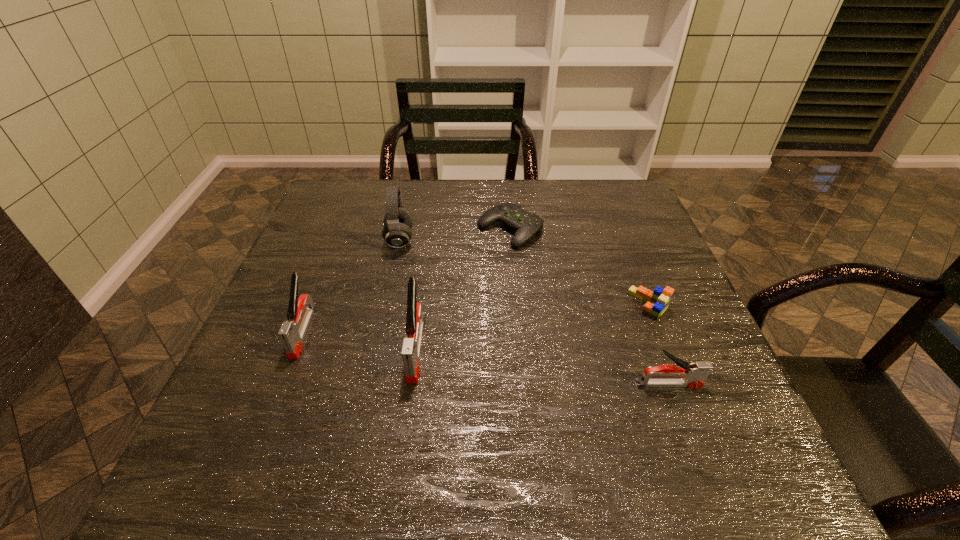
Where is `vacant space in between the second shortest stapler and the third object from right to left`? Image resolution: width=960 pixels, height=540 pixels. vacant space in between the second shortest stapler and the third object from right to left is located at coordinates click(x=407, y=280).

Where is `empty space that is in between the third tallest object and the shortest object`? empty space that is in between the third tallest object and the shortest object is located at coordinates (407, 280).

Locate an element on the screen. The width and height of the screenshot is (960, 540). free space between the shortest object and the second stapler from left to right is located at coordinates (463, 289).

What are the coordinates of `vacant space in between the Lego and the second object from left to right` in the screenshot? It's located at (524, 272).

The image size is (960, 540). What are the coordinates of `object that is the second nearest to the fifth object from right to left` in the screenshot? It's located at (292, 332).

At what (x,y) coordinates should I click in order to perform the action: click on the fifth closest object to the leftmost stapler. Please return your answer as a coordinate pair (x, y). The width and height of the screenshot is (960, 540). Looking at the image, I should click on (657, 301).

Identify which stapler is located as the nearest to the leftmost stapler. Please provide its 2D coordinates. Your answer should be formatted as a tuple, i.e. [(x, y)], where the tuple contains the x and y coordinates of a point satisfying the conditions above.

[(410, 352)]

In order to click on the third closest stapler to the second shortest object in this screenshot , I will do `click(292, 332)`.

Where is `vacant point that satisfies the following two spatial constraints: 1. on the front side of the Lego; 2. on the handle side of the third shortest object`? The height and width of the screenshot is (540, 960). vacant point that satisfies the following two spatial constraints: 1. on the front side of the Lego; 2. on the handle side of the third shortest object is located at coordinates (681, 384).

Locate an element on the screen. free space in the image that satisfies the following two spatial constraints: 1. on the ear cups of the Lego; 2. on the left side of the fifth object from right to left is located at coordinates (385, 304).